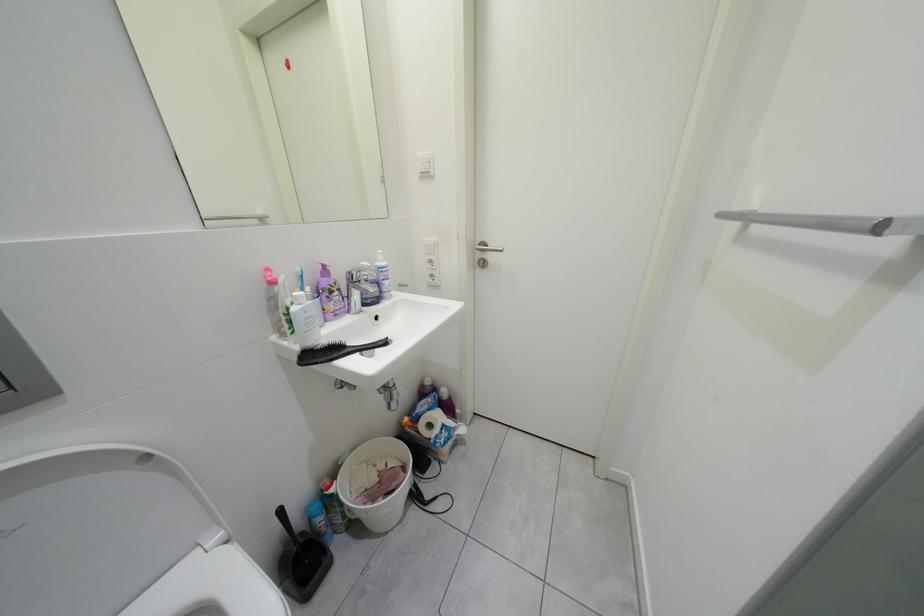
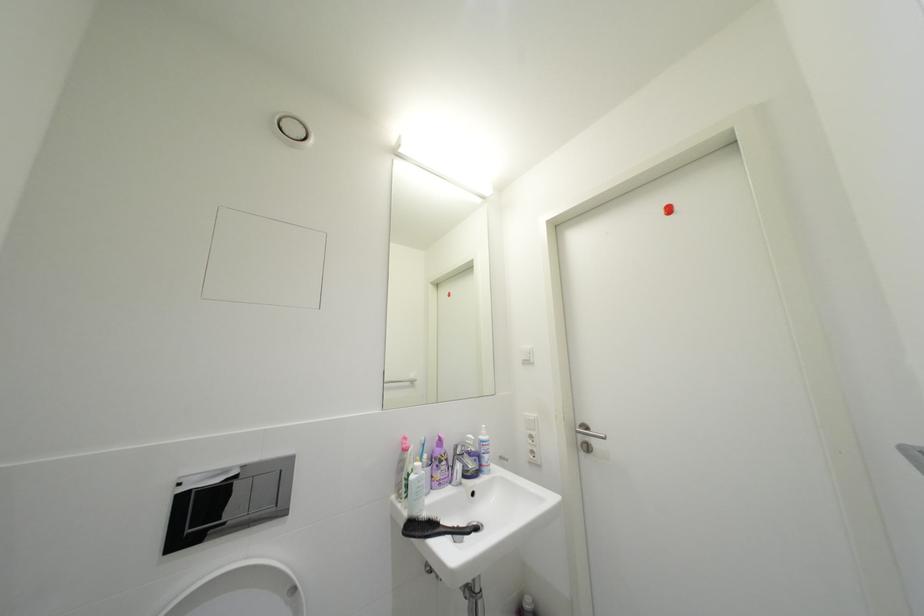
Based on the continuous images, in which direction is the camera rotating?

The rotation direction of the camera is left-up.